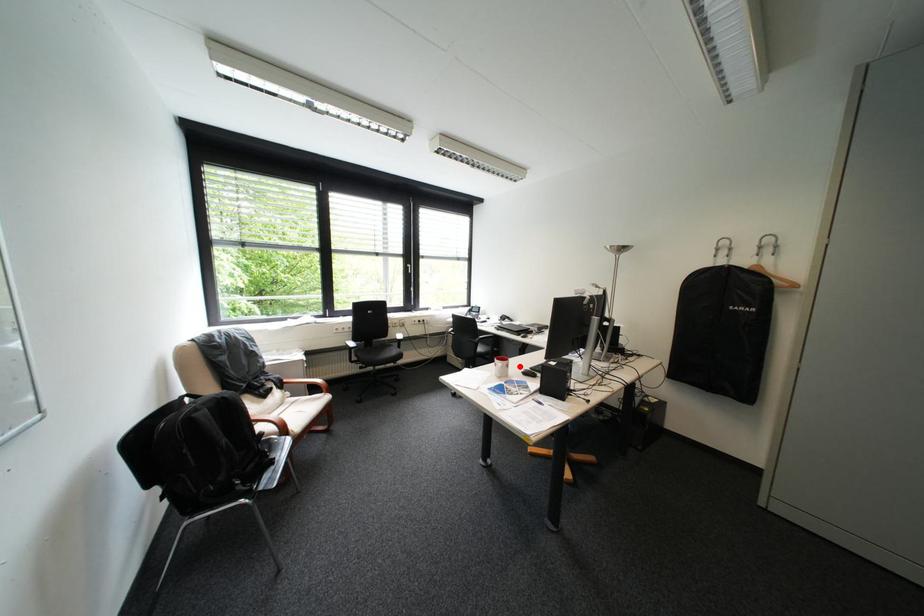
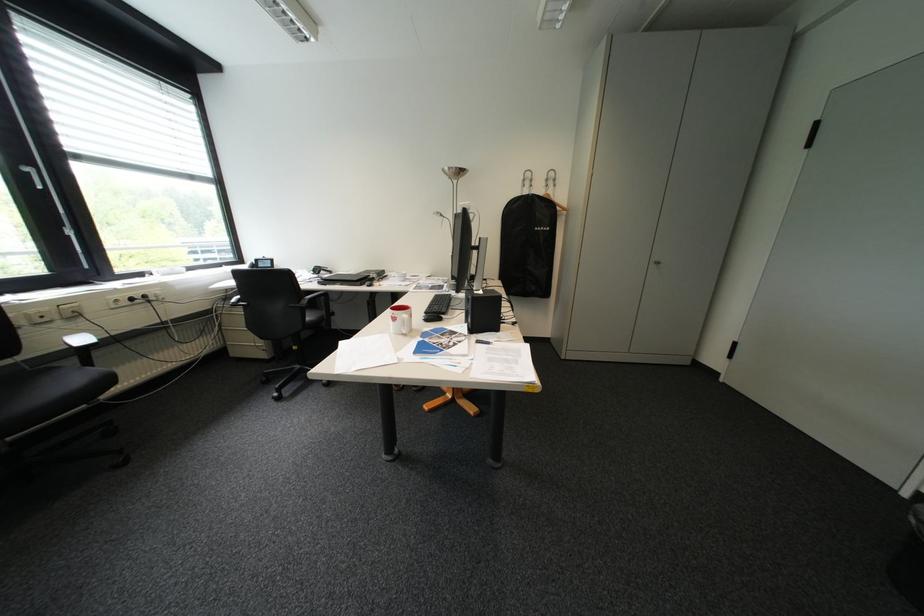
Locate, in the second image, the point that corresponds to the highlighted location in the first image.

(423, 315)